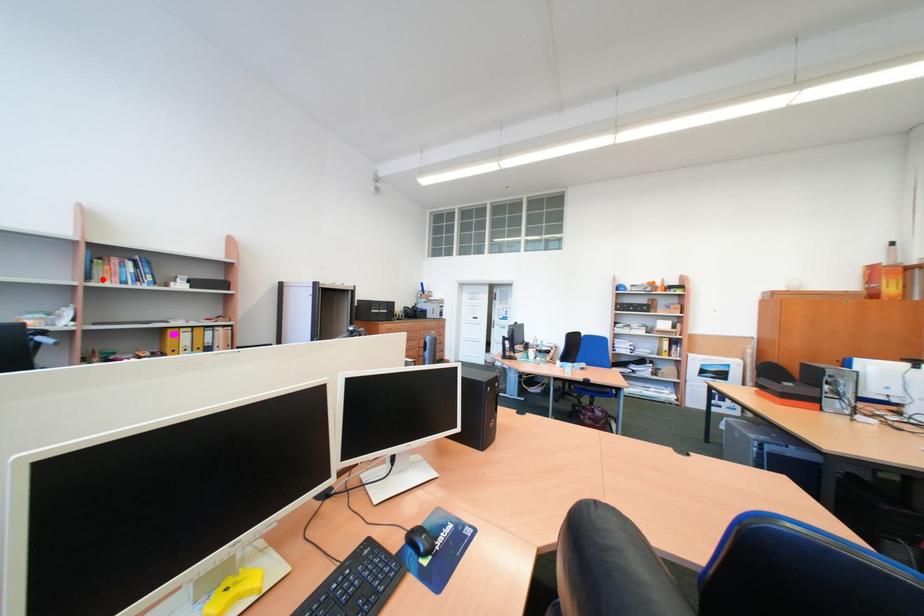
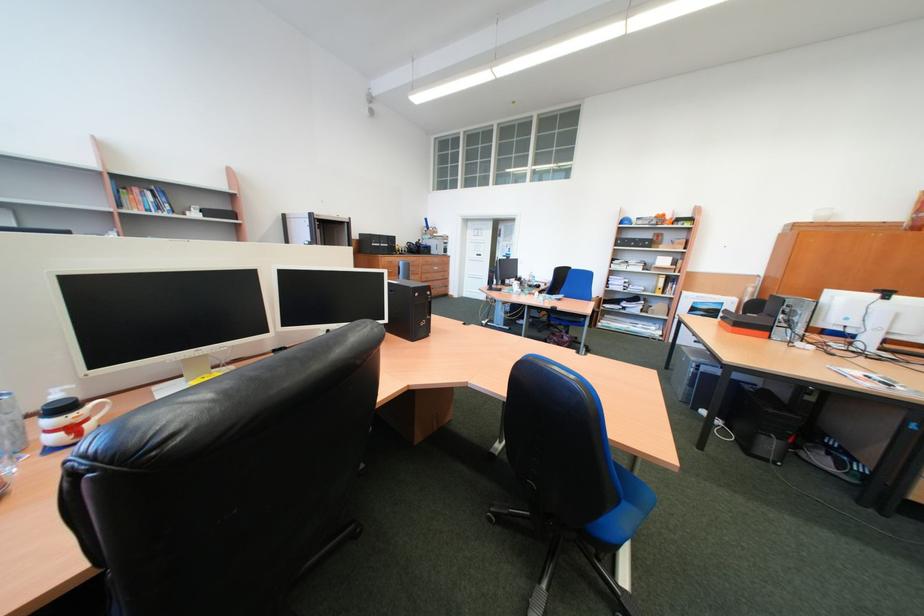
Locate, in the second image, the point that corresponds to the highlighted location in the first image.

(134, 207)